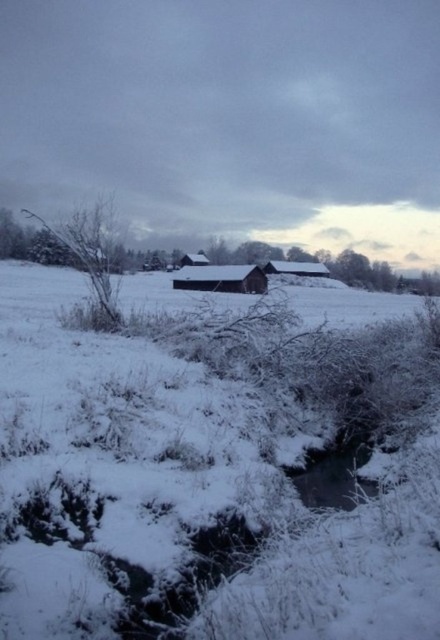
Who is taller, white fluffy snow at center or brown wooden hut at center?

With more height is white fluffy snow at center.

Is white fluffy snow at center wider than brown wooden hut at center?

Indeed, white fluffy snow at center has a greater width compared to brown wooden hut at center.

Is point (433, 522) positioned before point (183, 257)?

Yes, it is.

The height and width of the screenshot is (640, 440). Find the location of `white fluffy snow at center`. white fluffy snow at center is located at coordinates (209, 467).

Consider the image. Who is lower down, white fluffy snow at center or white wooden hut at center?

Positioned lower is white fluffy snow at center.

Who is shorter, white fluffy snow at center or white wooden hut at center?

white wooden hut at center

Is point (234, 445) closer to camera compared to point (176, 284)?

That is True.

I want to click on white fluffy snow at center, so (x=209, y=467).

Does white fluffy snow at center appear on the right side of wooden barn at center?

Incorrect, white fluffy snow at center is not on the right side of wooden barn at center.

Is white fluffy snow at center smaller than wooden barn at center?

No, white fluffy snow at center is not smaller than wooden barn at center.

What do you see at coordinates (209, 467) in the screenshot? The width and height of the screenshot is (440, 640). I see `white fluffy snow at center` at bounding box center [209, 467].

Where is `white fluffy snow at center`? The image size is (440, 640). white fluffy snow at center is located at coordinates (209, 467).